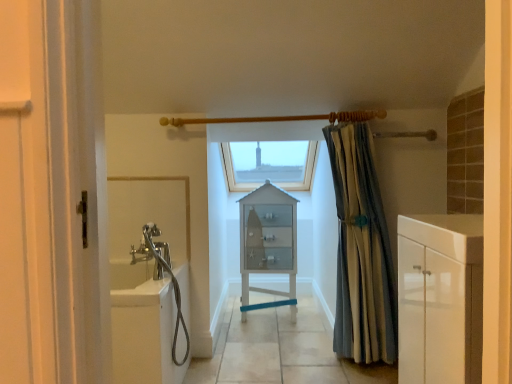
Find the location of a particular element. Image resolution: width=512 pixels, height=384 pixels. white tile floor at center is located at coordinates (280, 350).

Where is `white glossy bathtub at left`? Image resolution: width=512 pixels, height=384 pixels. white glossy bathtub at left is located at coordinates (144, 333).

Where is `transparent glass window at center`? The height and width of the screenshot is (384, 512). transparent glass window at center is located at coordinates (267, 156).

This screenshot has width=512, height=384. What do you see at coordinates (361, 251) in the screenshot?
I see `striped fabric curtain at right` at bounding box center [361, 251].

What is the approximate height of white glass cabinet at center?

white glass cabinet at center is 1.02 meters in height.

Describe the element at coordinates (446, 234) in the screenshot. This screenshot has width=512, height=384. I see `white glossy cabinet at right` at that location.

Find the location of a particular element. This screenshot has width=512, height=384. white glossy cabinet at right is located at coordinates (440, 298).

Is white glossy bathtub at left looking in the opposite direction of striped fabric curtain at right?

Yes, striped fabric curtain at right is at the back of white glossy bathtub at left.

Is white glossy bathtub at left far away from striped fabric curtain at right?

white glossy bathtub at left is positioned a significant distance from striped fabric curtain at right.

Is white glossy bathtub at left positioned beyond the bounds of striped fabric curtain at right?

Yes.

Based on their sizes in the image, would you say white glossy bathtub at left is bigger or smaller than transparent glass window at center?

white glossy bathtub at left is smaller than transparent glass window at center.

Is white glossy bathtub at left wider or thinner than transparent glass window at center?

white glossy bathtub at left is thinner than transparent glass window at center.

In order to click on bath that appears below the transparent glass window at center (from a real-world perspective) in this screenshot , I will do `click(144, 333)`.

Is white glossy bathtub at left not close to transparent glass window at center?

Yes, white glossy bathtub at left and transparent glass window at center are located far from each other.

Based on the photo, considering the relative sizes of transparent glass window at center and striped fabric curtain at right in the image provided, is transparent glass window at center bigger than striped fabric curtain at right?

Yes, transparent glass window at center is bigger than striped fabric curtain at right.

Which is more to the right, transparent glass window at center or striped fabric curtain at right?

striped fabric curtain at right.

In the scene shown: From a real-world perspective, is transparent glass window at center positioned above or below striped fabric curtain at right?

From a real-world perspective, transparent glass window at center is physically above striped fabric curtain at right.

Between transparent glass window at center and striped fabric curtain at right, which one is positioned behind?

Positioned behind is transparent glass window at center.

Consider the image. Is the position of striped fabric curtain at right less distant than that of white glass cabinet at center?

Yes, striped fabric curtain at right is in front of white glass cabinet at center.

Is striped fabric curtain at right looking in the opposite direction of white glass cabinet at center?

No, striped fabric curtain at right's orientation is not away from white glass cabinet at center.

How different are the orientations of striped fabric curtain at right and white glass cabinet at center in degrees?

The facing directions of striped fabric curtain at right and white glass cabinet at center are 2.24 degrees apart.

Is striped fabric curtain at right thinner than white glass cabinet at center?

Yes.

Does white glossy bathtub at left contain white tile floor at center?

No.

From their relative heights in the image, would you say white glossy bathtub at left is taller or shorter than white tile floor at center?

Considering their sizes, white glossy bathtub at left has more height than white tile floor at center.

Between white glossy bathtub at left and white tile floor at center, which one has smaller size?

With smaller size is white glossy bathtub at left.

From a real-world perspective, is white glossy bathtub at left physically located above or below white tile floor at center?

white glossy bathtub at left is above white tile floor at center.

What's the angular difference between white glossy cabinet at right and transparent glass window at center's facing directions?

The facing directions of white glossy cabinet at right and transparent glass window at center are 89.3 degrees apart.

Is white glossy cabinet at right wider or thinner than transparent glass window at center?

white glossy cabinet at right is thinner than transparent glass window at center.

Is white glossy cabinet at right bigger than transparent glass window at center?

Incorrect, white glossy cabinet at right is not larger than transparent glass window at center.

Between transparent glass window at center and white glass cabinet at center, which one has smaller width?

With smaller width is white glass cabinet at center.

The height and width of the screenshot is (384, 512). Find the location of `cabinetry below the transparent glass window at center (from the image's perspective)`. cabinetry below the transparent glass window at center (from the image's perspective) is located at coordinates [x=268, y=243].

From the image's perspective, which one is positioned lower, transparent glass window at center or white glass cabinet at center?

white glass cabinet at center.

Is transparent glass window at center aimed at white glass cabinet at center?

No, transparent glass window at center is not turned towards white glass cabinet at center.

Identify the location of curtain on the right of white glossy bathtub at left. (361, 251).

You are a GUI agent. You are given a task and a screenshot of the screen. Output one action in this format:
    pyautogui.click(x=<x>, y=<y>)
    Task: Click on the bath that is in front of the transparent glass window at center
    This screenshot has width=512, height=384.
    Given the screenshot: What is the action you would take?
    pyautogui.click(x=144, y=333)

Looking at the image, which one is located closer to white glossy cabinet at right, striped fabric curtain at right or white tile floor at center?

striped fabric curtain at right is positioned closer to the anchor white glossy cabinet at right.

From the image, which object appears to be farther from white tile floor at center, white glossy cabinet at right or white glossy bathtub at left?

white glossy cabinet at right is further to white tile floor at center.

Looking at the image, which one is located further to white glass cabinet at center, white glossy bathtub at left or white tile floor at center?

white glossy bathtub at left lies further to white glass cabinet at center than the other object.

Estimate the real-world distances between objects in this image. Which object is further from white glossy bathtub at left, white glossy cabinet at right or white glossy cabinet at right?

white glossy cabinet at right is further to white glossy bathtub at left.

Estimate the real-world distances between objects in this image. Which object is further from white tile floor at center, white glossy cabinet at right or transparent glass window at center?

transparent glass window at center is positioned further to the anchor white tile floor at center.

Considering their positions, is white tile floor at center positioned further to transparent glass window at center than white glossy cabinet at right?

white glossy cabinet at right.

Which object lies nearer to the anchor point white glass cabinet at center, white glossy bathtub at left or white glossy cabinet at right?

Based on the image, white glossy bathtub at left appears to be nearer to white glass cabinet at center.

When comparing their distances from white glass cabinet at center, does striped fabric curtain at right or white glossy cabinet at right seem further?

white glossy cabinet at right is positioned further to the anchor white glass cabinet at center.

Find the location of a particular element. The height and width of the screenshot is (384, 512). curtain located between white glossy cabinet at right and white glass cabinet at center in the depth direction is located at coordinates (361, 251).

This screenshot has width=512, height=384. In order to click on cabinetry located between white glossy bathtub at left and transparent glass window at center in the depth direction in this screenshot , I will do `click(268, 243)`.

Image resolution: width=512 pixels, height=384 pixels. What are the coordinates of `bath between white glossy cabinet at right and white glass cabinet at center from front to back` in the screenshot? It's located at (144, 333).

The image size is (512, 384). Find the location of `curtain between white tile floor at center and white glass cabinet at center in the front-back direction`. curtain between white tile floor at center and white glass cabinet at center in the front-back direction is located at coordinates (361, 251).